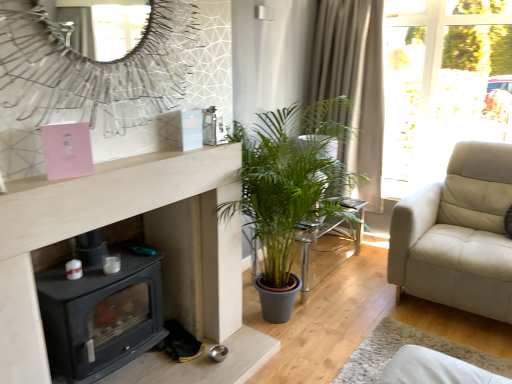
The image size is (512, 384). What do you see at coordinates (353, 83) in the screenshot?
I see `beige textured curtain at upper right` at bounding box center [353, 83].

The width and height of the screenshot is (512, 384). What do you see at coordinates (96, 67) in the screenshot? I see `metallic silver mirror at upper center` at bounding box center [96, 67].

Where is `black matte wood burning stove at lower left`? black matte wood burning stove at lower left is located at coordinates (101, 315).

Is black matte wood burning stove at lower left to the left or to the right of translucent glass table at center in the image?

In the image, black matte wood burning stove at lower left appears on the left side of translucent glass table at center.

Is black matte wood burning stove at lower left next to translucent glass table at center and touching it?

No, black matte wood burning stove at lower left is not beside translucent glass table at center.

From the image's perspective, would you say black matte wood burning stove at lower left is positioned over translucent glass table at center?

No, from the image's perspective, black matte wood burning stove at lower left is not on top of translucent glass table at center.

Relative to translucent glass table at center, is black matte wood burning stove at lower left in front or behind?

black matte wood burning stove at lower left is in front of translucent glass table at center.

From the image's perspective, which one is positioned higher, translucent glass table at center or black matte wood burning stove at lower left?

translucent glass table at center is shown above in the image.

Considering the sizes of translucent glass table at center and black matte wood burning stove at lower left in the image, is translucent glass table at center wider or thinner than black matte wood burning stove at lower left?

In the image, translucent glass table at center appears to be wider than black matte wood burning stove at lower left.

Which object is further away from the camera, translucent glass table at center or black matte wood burning stove at lower left?

translucent glass table at center.

Looking at this image, could you tell me if translucent glass table at center is facing black matte wood burning stove at lower left?

No, translucent glass table at center is not turned towards black matte wood burning stove at lower left.

Looking at this image, is metallic silver mirror at upper center not inside translucent glass table at center?

Yes, metallic silver mirror at upper center is not within translucent glass table at center.

From the image's perspective, which is below, metallic silver mirror at upper center or translucent glass table at center?

translucent glass table at center appears lower in the image.

Find the location of a particular element. This screenshot has width=512, height=384. table behind the metallic silver mirror at upper center is located at coordinates (322, 249).

In the scene shown: From a real-world perspective, which object rests below the other?

translucent glass table at center, from a real-world perspective.

From a real-world perspective, is beige textured curtain at upper right physically below black matte wood burning stove at lower left?

No, from a real-world perspective, beige textured curtain at upper right is not under black matte wood burning stove at lower left.

Is beige textured curtain at upper right shorter than black matte wood burning stove at lower left?

In fact, beige textured curtain at upper right may be taller than black matte wood burning stove at lower left.

Considering the positions of point (336, 83) and point (88, 382), is point (336, 83) closer or farther from the camera than point (88, 382)?

Clearly, point (336, 83) is more distant from the camera than point (88, 382).

Is beige textured curtain at upper right not near black matte wood burning stove at lower left?

Yes, beige textured curtain at upper right and black matte wood burning stove at lower left are quite far apart.

From a real-world perspective, which is physically above, beige textured curtain at upper right or translucent glass table at center?

beige textured curtain at upper right.

Which is more to the left, beige textured curtain at upper right or translucent glass table at center?

Positioned to the left is translucent glass table at center.

Are beige textured curtain at upper right and translucent glass table at center beside each other?

beige textured curtain at upper right and translucent glass table at center are clearly separated.

From the picture: Could you measure the distance between metallic silver mirror at upper center and beige textured curtain at upper right?

The distance of metallic silver mirror at upper center from beige textured curtain at upper right is 6.48 feet.

Would you say metallic silver mirror at upper center is to the left or to the right of beige textured curtain at upper right in the picture?

Clearly, metallic silver mirror at upper center is on the left of beige textured curtain at upper right in the image.

Is metallic silver mirror at upper center inside or outside of beige textured curtain at upper right?

metallic silver mirror at upper center is not enclosed by beige textured curtain at upper right.

From the image's perspective, who appears lower, metallic silver mirror at upper center or beige textured curtain at upper right?

metallic silver mirror at upper center is shown below in the image.

Which is in front, metallic silver mirror at upper center or black matte wood burning stove at lower left?

metallic silver mirror at upper center is closer to the camera.

Considering the sizes of objects metallic silver mirror at upper center and black matte wood burning stove at lower left in the image provided, who is bigger, metallic silver mirror at upper center or black matte wood burning stove at lower left?

black matte wood burning stove at lower left.

What are the coordinates of `table on the right of the black matte wood burning stove at lower left` in the screenshot? It's located at (322, 249).

The height and width of the screenshot is (384, 512). Identify the location of wood burning stove positioned vertically above the translucent glass table at center (from a real-world perspective). (101, 315).

Based on their spatial positions, is beige textured curtain at upper right or translucent glass table at center closer to black matte wood burning stove at lower left?

The object closer to black matte wood burning stove at lower left is translucent glass table at center.

Based on the photo, when comparing their distances from black matte wood burning stove at lower left, does metallic silver mirror at upper center or translucent glass table at center seem closer?

Among the two, metallic silver mirror at upper center is located nearer to black matte wood burning stove at lower left.

Looking at the image, which one is located closer to translucent glass table at center, black matte wood burning stove at lower left or metallic silver mirror at upper center?

Among the two, black matte wood burning stove at lower left is located nearer to translucent glass table at center.

Which object lies nearer to the anchor point beige textured curtain at upper right, translucent glass table at center or black matte wood burning stove at lower left?

translucent glass table at center lies closer to beige textured curtain at upper right than the other object.

Estimate the real-world distances between objects in this image. Which object is closer to beige textured curtain at upper right, metallic silver mirror at upper center or translucent glass table at center?

The object closer to beige textured curtain at upper right is translucent glass table at center.

From the image, which object appears to be nearer to black matte wood burning stove at lower left, translucent glass table at center or beige textured curtain at upper right?

translucent glass table at center lies closer to black matte wood burning stove at lower left than the other object.

Considering their positions, is metallic silver mirror at upper center positioned closer to translucent glass table at center than beige textured curtain at upper right?

The object closer to translucent glass table at center is beige textured curtain at upper right.

From the image, which object appears to be farther from translucent glass table at center, black matte wood burning stove at lower left or beige textured curtain at upper right?

black matte wood burning stove at lower left is positioned further to the anchor translucent glass table at center.

Where is `wood burning stove located between metallic silver mirror at upper center and beige textured curtain at upper right in the depth direction`? wood burning stove located between metallic silver mirror at upper center and beige textured curtain at upper right in the depth direction is located at coordinates (101, 315).

Where is `table between black matte wood burning stove at lower left and beige textured curtain at upper right`? This screenshot has height=384, width=512. table between black matte wood burning stove at lower left and beige textured curtain at upper right is located at coordinates (322, 249).

At what (x,y) coordinates should I click in order to perform the action: click on wood burning stove between metallic silver mirror at upper center and translucent glass table at center along the z-axis. Please return your answer as a coordinate pair (x, y). This screenshot has width=512, height=384. Looking at the image, I should click on point(101,315).

What are the coordinates of `table between metallic silver mirror at upper center and beige textured curtain at upper right along the z-axis` in the screenshot? It's located at (322, 249).